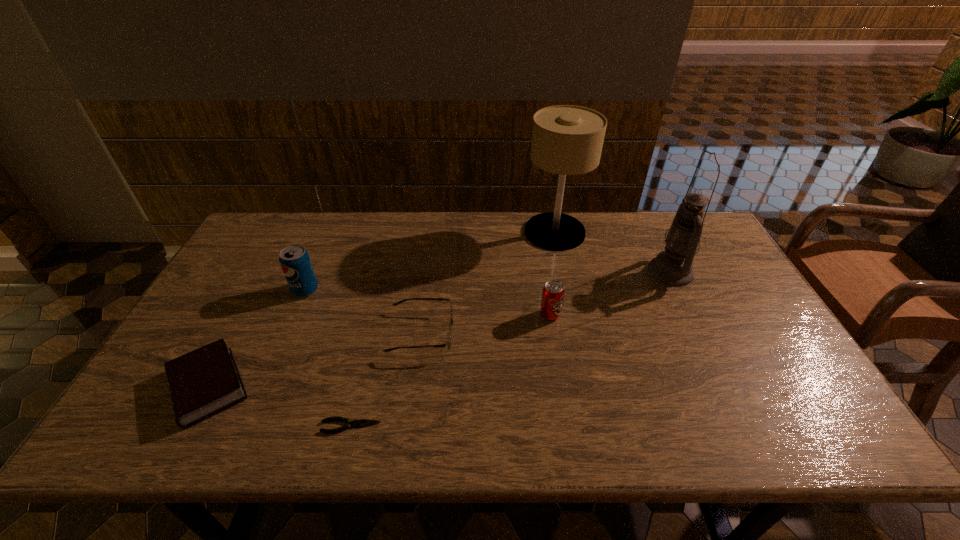
I want to click on table lamp, so click(566, 140).

You are a GUI agent. You are given a task and a screenshot of the screen. Output one action in this format:
    pyautogui.click(x=<x>, y=<y>)
    Task: Click on the oil lamp
    The image size is (960, 540).
    Given the screenshot: What is the action you would take?
    pyautogui.click(x=674, y=266)

Find the location of `the third tallest object`. the third tallest object is located at coordinates (295, 261).

Find the location of a particular element. Image resolution: width=960 pixels, height=540 pixels. the farther soda is located at coordinates (295, 261).

Locate an element on the screen. the shorter soda is located at coordinates (553, 292).

This screenshot has height=540, width=960. In order to click on the fourth shortest object in this screenshot , I will do `click(553, 292)`.

The image size is (960, 540). I want to click on spectacles, so click(x=448, y=344).

Locate an element on the screen. The width and height of the screenshot is (960, 540). Bible is located at coordinates (206, 381).

The width and height of the screenshot is (960, 540). In order to click on the shortest object in this screenshot , I will do `click(362, 422)`.

Locate an element on the screen. Image resolution: width=960 pixels, height=540 pixels. vacant space positioned 0.380m on the right of the table lamp is located at coordinates (696, 232).